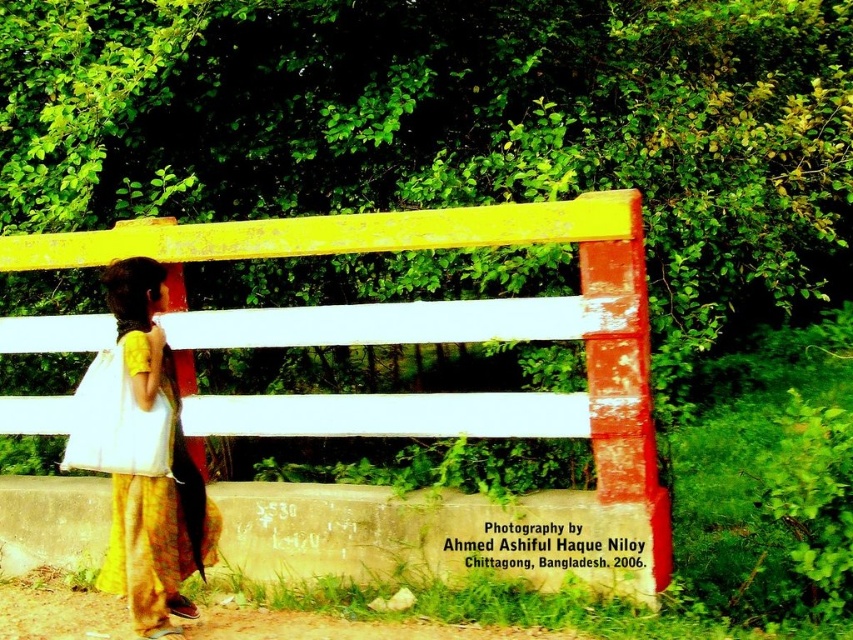
You are a painter who wants to paint a scene similar to the one shown. You have a limited amount of yellow paint. Which object should you paint first to conserve paint, the yellow painted wood fence at center or the yellow cotton dress at left?

The yellow cotton dress at left requires less yellow paint because it is smaller than the yellow painted wood fence at center.

You are a painter standing in front of the yellow painted wood fence at center and the yellow cotton dress at left. You want to paint both objects. Which object requires more paint to cover its entire surface area?

The yellow painted wood fence at center requires more paint because its width is greater than the yellow cotton dress at left, meaning it has a larger surface area to cover.